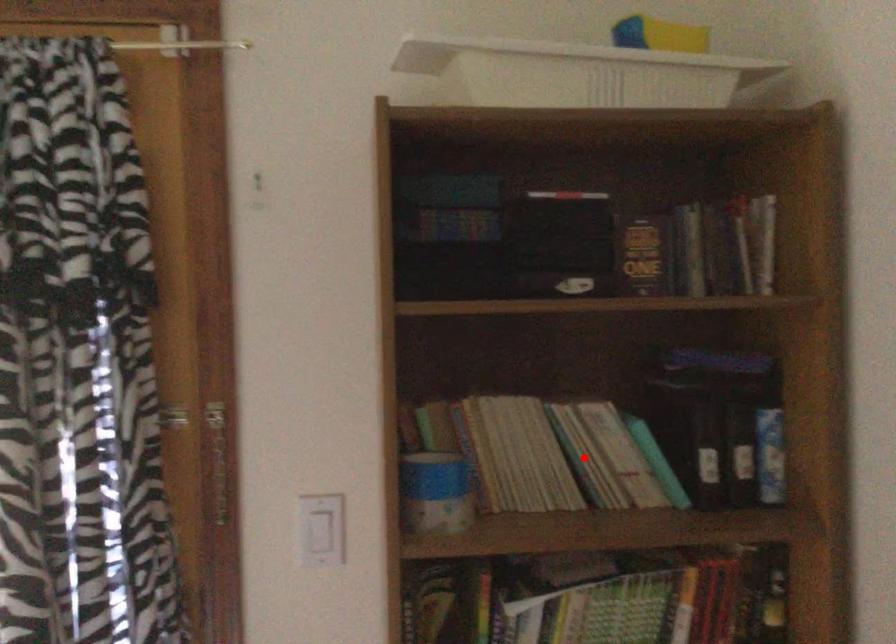
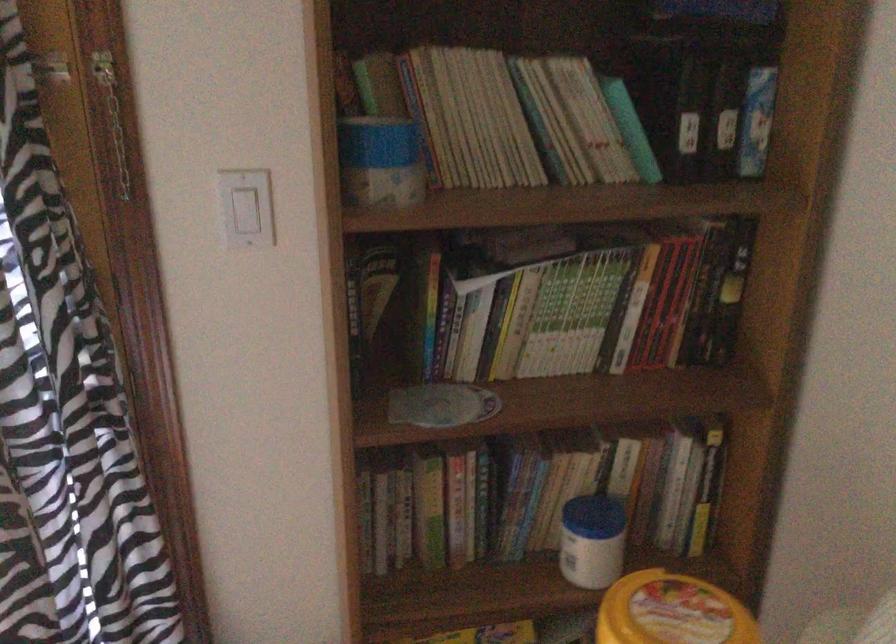
Question: A red point is marked in image1. In image2, is the corresponding 3D point closer to the camera or farther? Reply with the corresponding letter.

Choices:
 (A) The corresponding 3D point is closer.
 (B) The corresponding 3D point is farther.

Answer: (A)